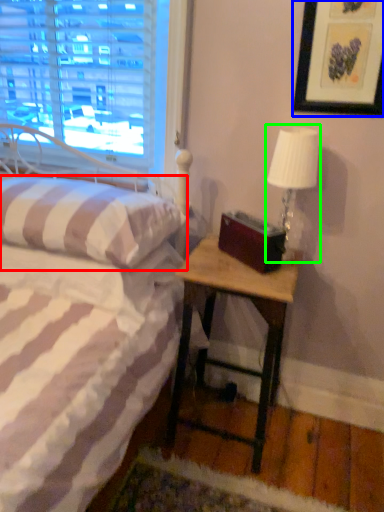
Question: Which object is positioned farthest from pillow (highlighted by a red box)? Select from picture frame (highlighted by a blue box) and table lamp (highlighted by a green box).

Choices:
 (A) picture frame
 (B) table lamp

Answer: (A)